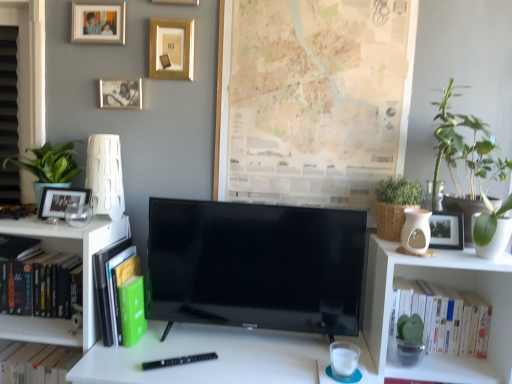
Where is `free location in front of black glossy tv at center`? The width and height of the screenshot is (512, 384). free location in front of black glossy tv at center is located at coordinates (245, 365).